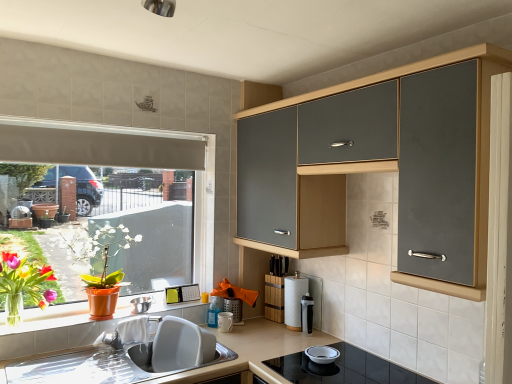
Image resolution: width=512 pixels, height=384 pixels. Identify the location of vacant space to the right of white ceramic mug at lower center, placed as the 3th appliance when sorted from left to right. (256, 337).